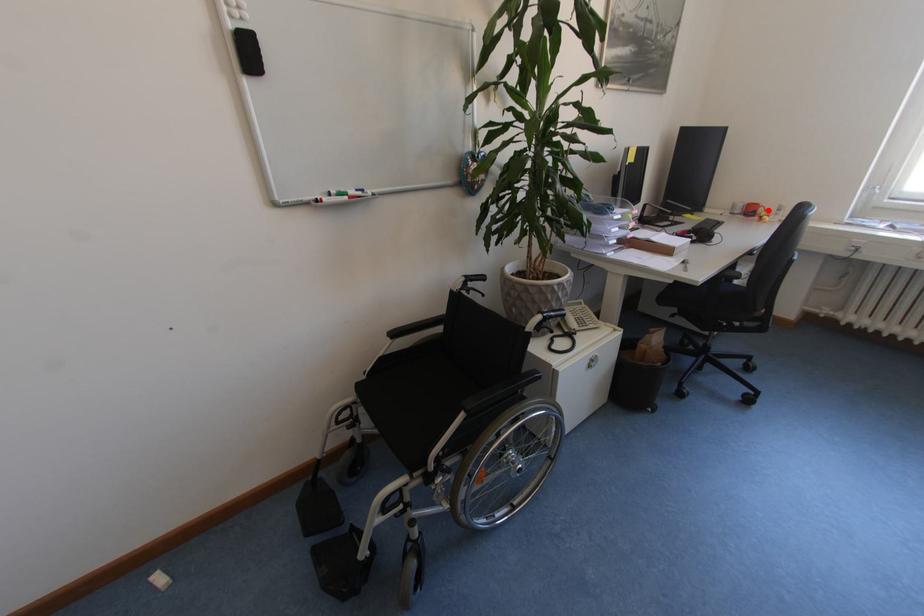
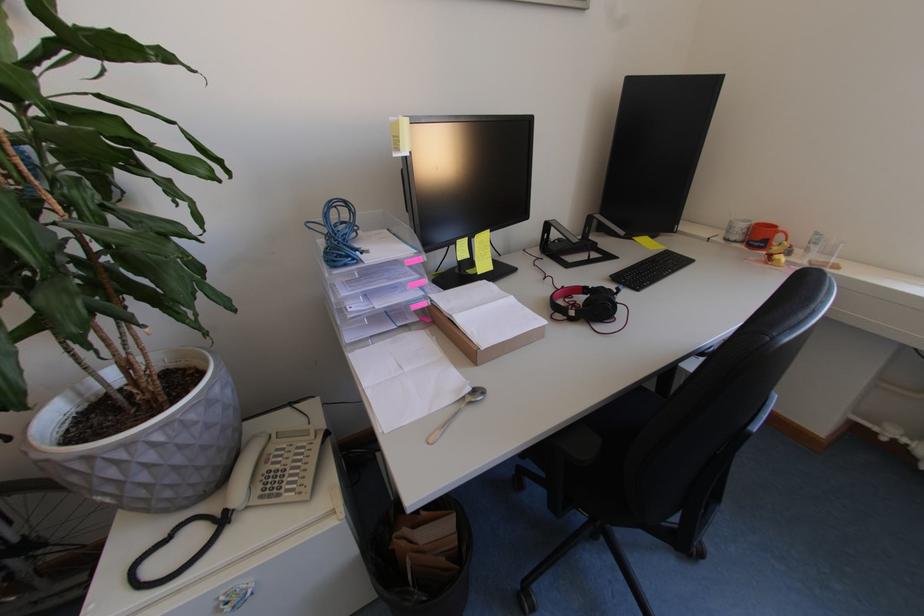
Locate, in the second image, the point that corresponds to the highlighted location in the first image.

(786, 238)